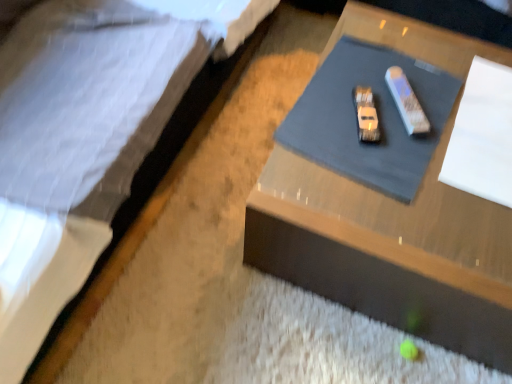
You are a GUI agent. You are given a task and a screenshot of the screen. Output one action in this format:
    pyautogui.click(x=<x>, y=<y>)
    Task: Click on the vacant space situated on the left part of white paper at upper right
    The image size is (512, 384).
    Given the screenshot: What is the action you would take?
    pyautogui.click(x=385, y=130)